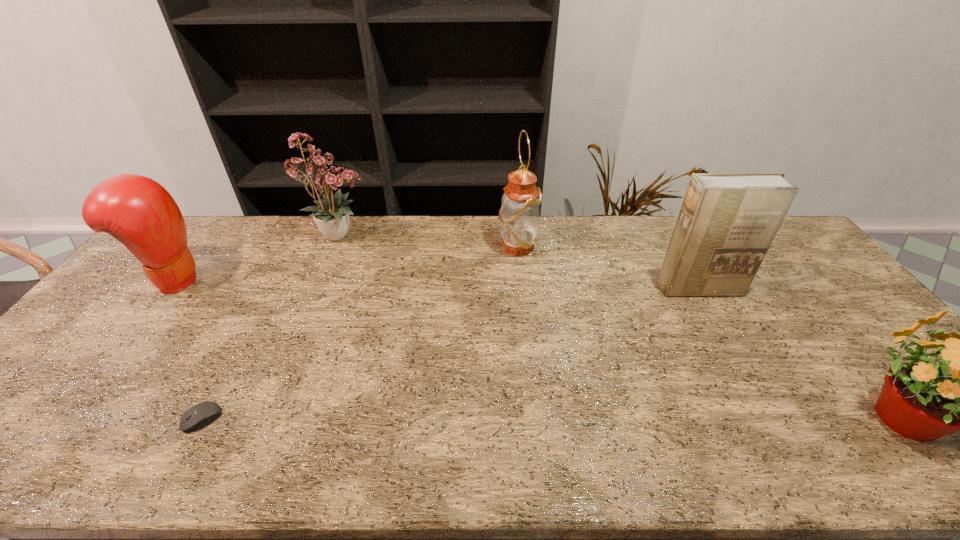
Locate an element on the screen. Image resolution: width=960 pixels, height=540 pixels. free space between the phonebook and the boxing glove is located at coordinates (436, 284).

Identify the location of unoccupied area between the shortest object and the oil lamp. The image size is (960, 540). (360, 333).

The height and width of the screenshot is (540, 960). I want to click on vacant space that is in between the leftmost object and the second object from right to left, so click(436, 284).

The image size is (960, 540). What are the coordinates of `vacant region between the leftmost object and the flower arrangement` in the screenshot? It's located at (257, 257).

This screenshot has height=540, width=960. I want to click on vacant space that is in between the second object from right to left and the leftmost object, so click(436, 284).

Point out which object is positioned as the fifth nearest to the flower arrangement. Please provide its 2D coordinates. Your answer should be formatted as a tuple, i.e. [(x, y)], where the tuple contains the x and y coordinates of a point satisfying the conditions above.

[(920, 400)]

Where is `object that stands as the second closest to the rightmost object`? The image size is (960, 540). object that stands as the second closest to the rightmost object is located at coordinates (519, 215).

At what (x,y) coordinates should I click in order to perform the action: click on free space in the image that satisfies the following two spatial constraints: 1. on the striking surface of the shortest object; 2. on the right side of the boxing glove. Please return your answer as a coordinate pair (x, y). Image resolution: width=960 pixels, height=540 pixels. Looking at the image, I should click on (64, 419).

This screenshot has height=540, width=960. I want to click on free location that satisfies the following two spatial constraints: 1. on the front-facing side of the flower arrangement; 2. on the left side of the oil lamp, so click(335, 247).

What are the coordinates of `vacant space that satisfies the following two spatial constraints: 1. on the front side of the third object from right to left; 2. on the striking surface of the leftmost object` in the screenshot? It's located at (520, 280).